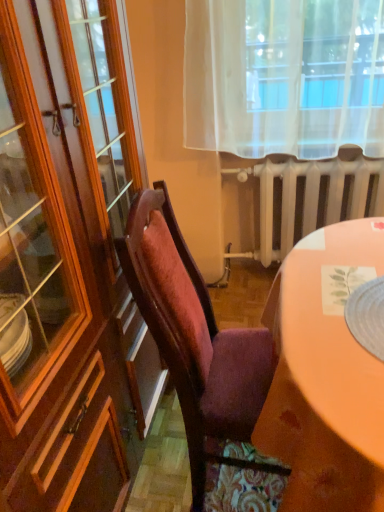
What is the approximate width of white metallic radiator at center?

The width of white metallic radiator at center is 7.49 inches.

This screenshot has width=384, height=512. What do you see at coordinates (294, 199) in the screenshot?
I see `white metallic radiator at center` at bounding box center [294, 199].

Image resolution: width=384 pixels, height=512 pixels. Find the location of `white metallic radiator at center`. white metallic radiator at center is located at coordinates (294, 199).

Describe the element at coordinates (195, 338) in the screenshot. The image size is (384, 512). I see `wooden chair at center` at that location.

Measure the distance between wooden chair at center and camera.

The depth of wooden chair at center is 91.61 centimeters.

What are the coordinates of `wooden chair at center` in the screenshot? It's located at (195, 338).

This screenshot has width=384, height=512. I want to click on white metallic radiator at center, so click(294, 199).

Which is more to the right, white metallic radiator at center or wooden chair at center?

white metallic radiator at center.

Is the position of white metallic radiator at center less distant than that of wooden chair at center?

No.

Is point (257, 173) closer to viewer compared to point (193, 447)?

No, it is behind (193, 447).

From the image's perspective, which object appears higher, white metallic radiator at center or wooden chair at center?

white metallic radiator at center, from the image's perspective.

From a real-world perspective, is white metallic radiator at center under wooden chair at center?

Yes, from a real-world perspective, white metallic radiator at center is below wooden chair at center.

Considering the sizes of objects white metallic radiator at center and wooden chair at center in the image provided, who is thinner, white metallic radiator at center or wooden chair at center?

white metallic radiator at center is thinner.

Who is shorter, white metallic radiator at center or wooden chair at center?

white metallic radiator at center.

Between white metallic radiator at center and wooden chair at center, which one has smaller size?

With smaller size is white metallic radiator at center.

Consider the image. Is white metallic radiator at center inside or outside of wooden chair at center?

white metallic radiator at center cannot be found inside wooden chair at center.

Are white metallic radiator at center and wooden chair at center far apart?

Yes.

Is white metallic radiator at center facing towards wooden chair at center?

Yes, white metallic radiator at center is oriented towards wooden chair at center.

The height and width of the screenshot is (512, 384). I want to click on chair in front of the white metallic radiator at center, so click(195, 338).

Does wooden chair at center appear on the left side of white metallic radiator at center?

Yes.

Which object is closer to the camera, wooden chair at center or white metallic radiator at center?

wooden chair at center is more forward.

Is point (149, 238) farther from camera compared to point (329, 206)?

No, (149, 238) is closer to viewer.

From the image's perspective, is wooden chair at center on white metallic radiator at center?

No, from the image's perspective, wooden chair at center is not on top of white metallic radiator at center.

From a real-world perspective, is wooden chair at center physically above white metallic radiator at center?

Indeed, from a real-world perspective, wooden chair at center stands above white metallic radiator at center.

Does wooden chair at center have a greater width compared to white metallic radiator at center?

Indeed, wooden chair at center has a greater width compared to white metallic radiator at center.

Does wooden chair at center have a lesser height compared to white metallic radiator at center?

Incorrect, the height of wooden chair at center does not fall short of that of white metallic radiator at center.

Who is smaller, wooden chair at center or white metallic radiator at center?

white metallic radiator at center is smaller.

Which is correct: wooden chair at center is inside white metallic radiator at center, or outside of it?

wooden chair at center lies outside white metallic radiator at center.

Would you say wooden chair at center is a long distance from white metallic radiator at center?

wooden chair at center is far away from white metallic radiator at center.

Does wooden chair at center turn towards white metallic radiator at center?

No, wooden chair at center is not turned towards white metallic radiator at center.

Measure the distance from wooden chair at center to white metallic radiator at center.

They are 3.47 feet apart.

Where is `radiator below the wooden chair at center (from a real-world perspective)`? This screenshot has width=384, height=512. radiator below the wooden chair at center (from a real-world perspective) is located at coordinates point(294,199).

Identify the location of radiator lying on the right of wooden chair at center. (294, 199).

At what (x,y) coordinates should I click in order to perform the action: click on radiator behind the wooden chair at center. Please return your answer as a coordinate pair (x, y). The image size is (384, 512). Looking at the image, I should click on (294, 199).